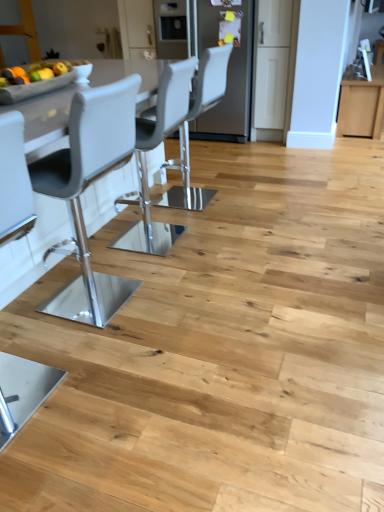
Image resolution: width=384 pixels, height=512 pixels. In order to click on free space behind matte gray chair at center, which is counted as the first chair, starting from the top in this screenshot , I will do `click(211, 177)`.